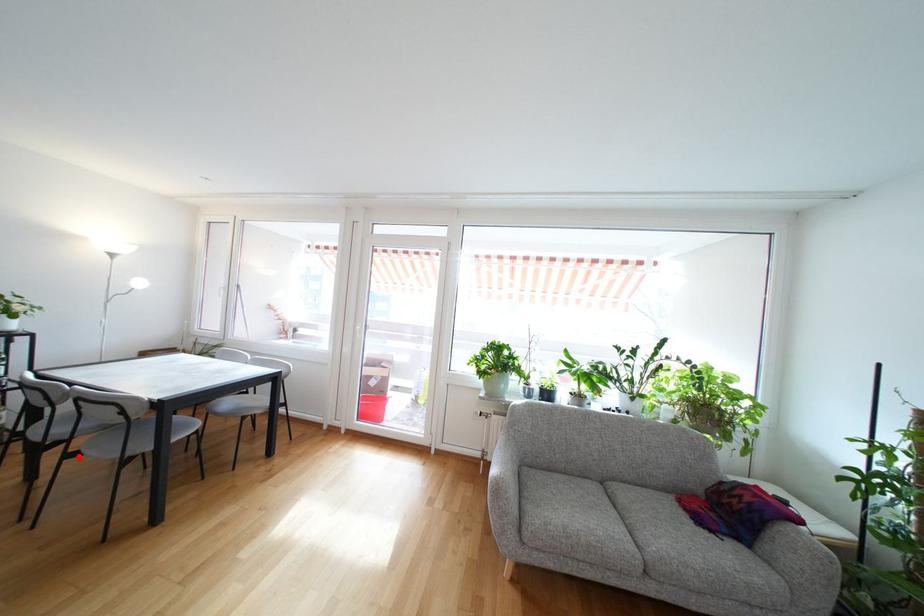
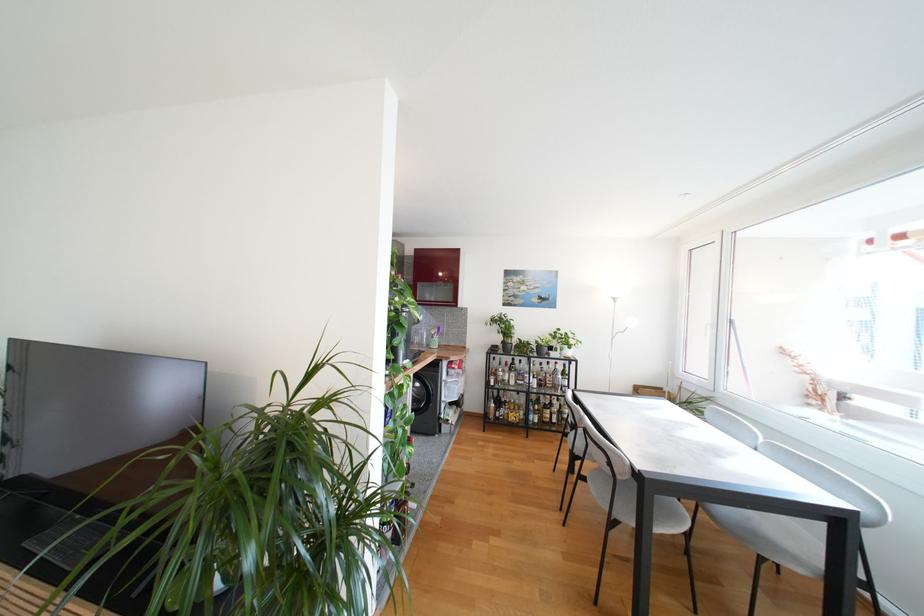
Question: I am providing you with two images of the same scene from different viewpoints. Image1 has a red point marked. In image2, the corresponding 3D location appears at what relative position? Reply with the corresponding letter.

Choices:
 (A) Closer
 (B) Farther

Answer: (B)